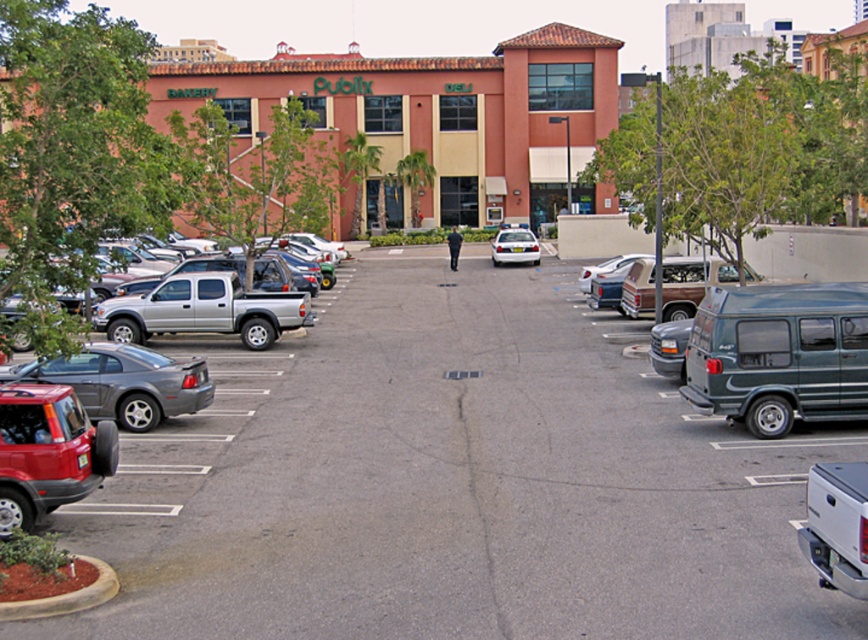
Question: Which of the following is the closest to the observer?

Choices:
 (A) (583, 292)
 (B) (735, 273)
 (C) (50, 381)
 (D) (306, 296)

Answer: (C)

Question: Considering the relative positions of gray asphalt parking lot at center and matte red suv at left in the image provided, where is gray asphalt parking lot at center located with respect to matte red suv at left?

Choices:
 (A) above
 (B) below

Answer: (B)

Question: Which object is farther from the camera taking this photo?

Choices:
 (A) matte red suv at left
 (B) shiny red suv at lower left
 (C) gray asphalt parking lot at center
 (D) metallic gray car at left

Answer: (D)

Question: Does shiny red suv at lower left lie in front of matte brown van at center-right?

Choices:
 (A) yes
 (B) no

Answer: (A)

Question: Which object appears closest to the camera in this image?

Choices:
 (A) shiny red suv at lower left
 (B) green matte van at right
 (C) matte red suv at left
 (D) metallic gray car at left

Answer: (C)

Question: Is gray asphalt parking lot at center above metallic gray car at left?

Choices:
 (A) no
 (B) yes

Answer: (A)